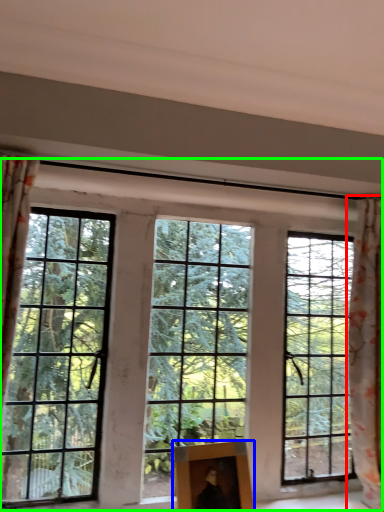
Question: Based on their relative distances, which object is farther from curtain (highlighted by a red box)? Choose from picture frame (highlighted by a blue box) and window (highlighted by a green box).

Choices:
 (A) picture frame
 (B) window

Answer: (A)